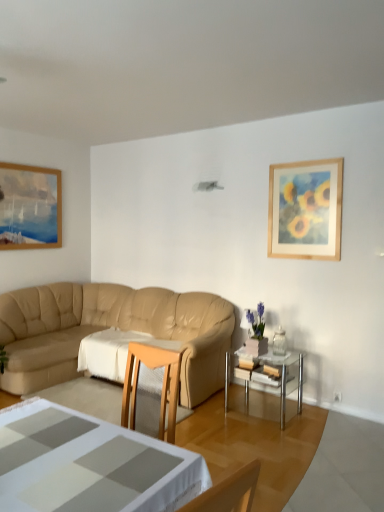
Question: Is beige leather couch at center positioned far away from clear glass table at center?

Choices:
 (A) no
 (B) yes

Answer: (B)

Question: Does beige leather couch at center have a lesser height compared to clear glass table at center?

Choices:
 (A) yes
 (B) no

Answer: (B)

Question: From the image's perspective, does beige leather couch at center appear higher than clear glass table at center?

Choices:
 (A) no
 (B) yes

Answer: (B)

Question: Considering the relative positions of beige leather couch at center and clear glass table at center in the image provided, is beige leather couch at center in front of clear glass table at center?

Choices:
 (A) no
 (B) yes

Answer: (B)

Question: From a real-world perspective, is beige leather couch at center under clear glass table at center?

Choices:
 (A) yes
 (B) no

Answer: (B)

Question: Considering the relative sizes of beige leather couch at center and clear glass table at center in the image provided, is beige leather couch at center thinner than clear glass table at center?

Choices:
 (A) yes
 (B) no

Answer: (B)

Question: Is white fabric tablecloth at center looking in the opposite direction of clear glass table at center?

Choices:
 (A) no
 (B) yes

Answer: (A)

Question: From a real-world perspective, does white fabric tablecloth at center sit lower than clear glass table at center?

Choices:
 (A) yes
 (B) no

Answer: (B)

Question: From the image's perspective, is white fabric tablecloth at center on top of clear glass table at center?

Choices:
 (A) yes
 (B) no

Answer: (A)

Question: Considering the relative positions of white fabric tablecloth at center and clear glass table at center in the image provided, is white fabric tablecloth at center behind clear glass table at center?

Choices:
 (A) yes
 (B) no

Answer: (A)

Question: Can you confirm if white fabric tablecloth at center is positioned to the left of clear glass table at center?

Choices:
 (A) no
 (B) yes

Answer: (B)

Question: Is white fabric tablecloth at center bigger than clear glass table at center?

Choices:
 (A) yes
 (B) no

Answer: (A)

Question: Considering the relative sizes of white glossy coffee table at lower center and wooden framed painting at upper right in the image provided, is white glossy coffee table at lower center taller than wooden framed painting at upper right?

Choices:
 (A) yes
 (B) no

Answer: (B)